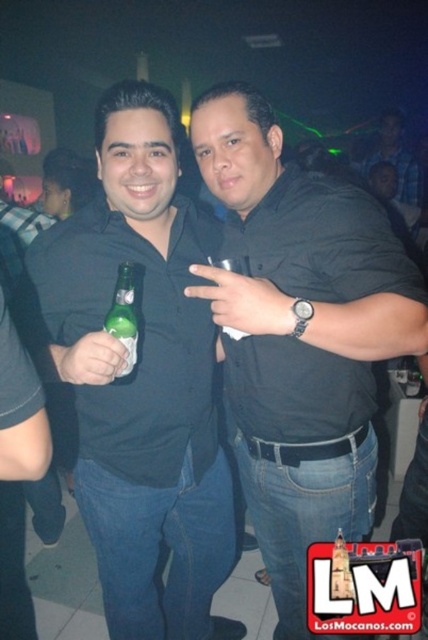
You are standing in a dimly lit social space with two people in front of you. You need to reach a point exactly between the two individuals. Given that the distance from your current position to point (148, 502) is 1.55 meters, can you determine if moving forward 1.55 meters will place you exactly at that midpoint?

Moving forward 1.55 meters will place you exactly at point (148, 502), which is the midpoint between the two individuals.

You are a photographer trying to capture a clear shot of the blue plaid shirt at upper right. However, the green matte bottle at left is blocking your view. Can you adjust your position to avoid the bottle and still see the shirt?

Yes, since the green matte bottle at left is in front of the blue plaid shirt at upper right, moving your camera angle slightly to the right or left could allow you to see around the bottle and capture the shirt without obstruction.

You are a photographer at a crowded event. You need to capture a photo where both the black matte shirt at center and the green glass bottle at center are clearly visible. Considering their sizes, which object should you focus on to ensure both are in frame without cropping?

The black matte shirt at center is wider than the green glass bottle at center. To ensure both are in frame without cropping, focus on the black matte shirt at center since it takes up more space, allowing the narrower green glass bottle at center to fit alongside.